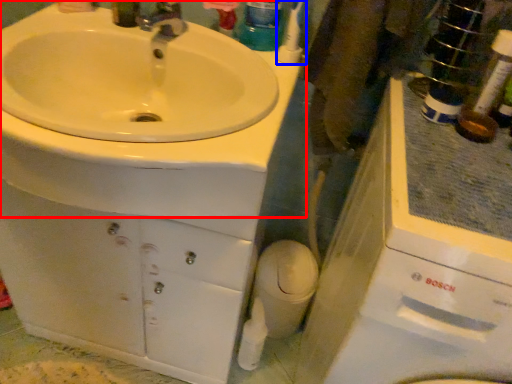
Question: Which object is further to the camera taking this photo, sink (highlighted by a red box) or toothbrush (highlighted by a blue box)?

Choices:
 (A) sink
 (B) toothbrush

Answer: (B)